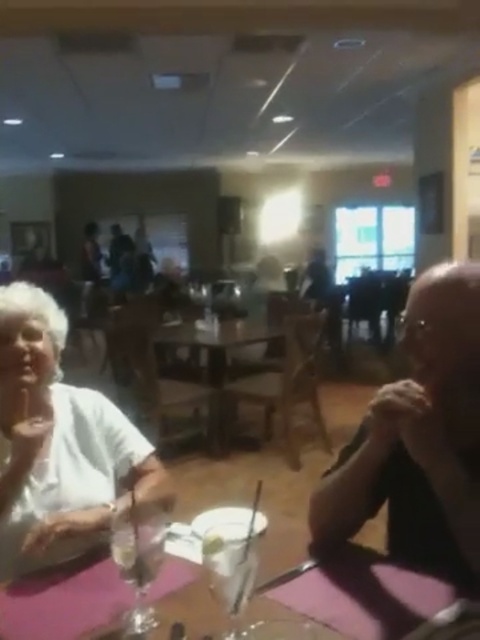
Question: Is pink matte table at center in front of white paper at center?

Choices:
 (A) no
 (B) yes

Answer: (B)

Question: Which of these objects is positioned closest to the pink matte table at center?

Choices:
 (A) white paper at center
 (B) white matte shirt at left
 (C) wooden table at center
 (D) smooth black shirt at right

Answer: (A)

Question: Which object is the closest to the pink matte table at center?

Choices:
 (A) white paper at center
 (B) smooth black shirt at right
 (C) wooden table at center
 (D) white matte shirt at left

Answer: (A)

Question: Can you confirm if pink matte table at center is thinner than wooden table at center?

Choices:
 (A) no
 (B) yes

Answer: (B)

Question: Which object is closer to the camera taking this photo?

Choices:
 (A) smooth black shirt at right
 (B) pink matte table at center

Answer: (B)

Question: Can you confirm if pink matte table at center is positioned to the right of wooden table at center?

Choices:
 (A) yes
 (B) no

Answer: (A)